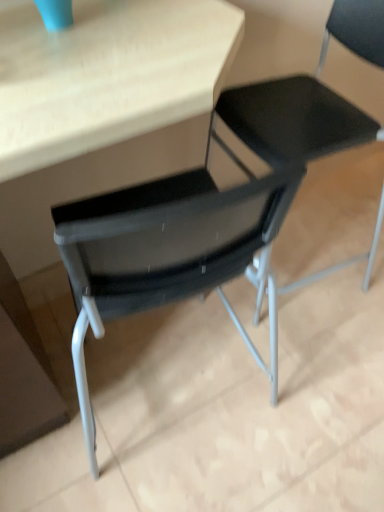
Locate an element on the screen. This screenshot has height=512, width=384. vacant space situated above matte wood table at center (from a real-world perspective) is located at coordinates (112, 92).